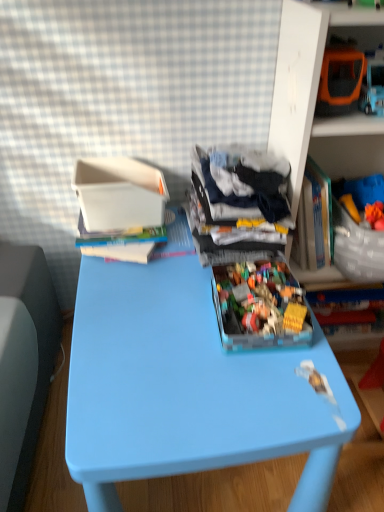
This screenshot has width=384, height=512. What do you see at coordinates (296, 88) in the screenshot?
I see `translucent plastic container at upper right, arranged as the 1th shelf when viewed from the right` at bounding box center [296, 88].

Describe the element at coordinates (189, 388) in the screenshot. The width and height of the screenshot is (384, 512). I see `blue plastic table at center` at that location.

Where is `translucent plastic container at center`? The image size is (384, 512). translucent plastic container at center is located at coordinates (260, 306).

What do you see at coordinates (119, 194) in the screenshot? I see `white plastic container at upper left` at bounding box center [119, 194].

Measure the distance between white plastic container at upper left and camera.

They are 1.10 meters apart.

Locate an element on the screen. The width and height of the screenshot is (384, 512). orange plastic toy car at upper right, the 2th shelf from the right is located at coordinates (348, 125).

Can you confirm if blue plastic table at center is smaller than dark blue fabric at center?

Incorrect, blue plastic table at center is not smaller in size than dark blue fabric at center.

Considering the sizes of blue plastic table at center and dark blue fabric at center in the image, is blue plastic table at center wider or thinner than dark blue fabric at center?

Considering their sizes, blue plastic table at center looks broader than dark blue fabric at center.

From a real-world perspective, between blue plastic table at center and dark blue fabric at center, who is vertically higher?

dark blue fabric at center is physically above.

Where is `table in front of the dark blue fabric at center`? table in front of the dark blue fabric at center is located at coordinates (189, 388).

Locate an element on the screen. The height and width of the screenshot is (512, 384). toy lying in front of the dark blue fabric at center is located at coordinates (260, 306).

Could translucent plastic container at center be considered to be inside dark blue fabric at center?

No.

Which of these two, dark blue fabric at center or translucent plastic container at center, stands shorter?

translucent plastic container at center is shorter.

From the image's perspective, is dark blue fabric at center above or below translucent plastic container at center?

Based on their image positions, dark blue fabric at center is located above translucent plastic container at center.

From a real-world perspective, is orange plastic toy car at upper right, the 2th shelf from the right, physically located above or below dark blue fabric at center?

Clearly, from a real-world perspective, orange plastic toy car at upper right, the 2th shelf from the right, is above dark blue fabric at center.

Is orange plastic toy car at upper right, the 2th shelf from the right, oriented away from dark blue fabric at center?

No, dark blue fabric at center is not at the back of orange plastic toy car at upper right, the 2th shelf from the right.

From the image's perspective, between orange plastic toy car at upper right, the 2th shelf from the right, and dark blue fabric at center, who is located below?

dark blue fabric at center is shown below in the image.

Is translucent plastic container at upper right, marked as the second shelf in a left-to-right arrangement, facing towards translucent plastic container at center?

No, translucent plastic container at upper right, marked as the second shelf in a left-to-right arrangement, is not oriented towards translucent plastic container at center.

Starting from the translucent plastic container at center, which shelf is the 2nd one to the right? Please provide its 2D coordinates.

[(296, 88)]

Is translucent plastic container at upper right, arranged as the 1th shelf when viewed from the right, wider or thinner than translucent plastic container at center?

In the image, translucent plastic container at upper right, arranged as the 1th shelf when viewed from the right, appears to be wider than translucent plastic container at center.

From the image's perspective, is translucent plastic container at upper right, marked as the second shelf in a left-to-right arrangement, positioned above or below translucent plastic container at center?

From the image's perspective, translucent plastic container at upper right, marked as the second shelf in a left-to-right arrangement, appears above translucent plastic container at center.

Measure the distance between blue plastic table at center and orange plastic toy car at upper right, the 2th shelf from the right.

blue plastic table at center is 24.46 inches away from orange plastic toy car at upper right, the 2th shelf from the right.

Is blue plastic table at center taller or shorter than orange plastic toy car at upper right, the 2th shelf from the right?

In the image, blue plastic table at center appears to be taller than orange plastic toy car at upper right, the 2th shelf from the right.

From a real-world perspective, who is located higher, blue plastic table at center or orange plastic toy car at upper right, the first shelf viewed from the left?

orange plastic toy car at upper right, the first shelf viewed from the left, is physically above.

From the image's perspective, which is below, blue plastic table at center or orange plastic toy car at upper right, the 2th shelf from the right?

blue plastic table at center, from the image's perspective.

Is white plastic container at upper left next to blue plastic table at center and touching it?

white plastic container at upper left and blue plastic table at center are clearly separated.

Considering the relative sizes of white plastic container at upper left and blue plastic table at center in the image provided, is white plastic container at upper left shorter than blue plastic table at center?

Yes, white plastic container at upper left is shorter than blue plastic table at center.

Is white plastic container at upper left inside the boundaries of blue plastic table at center, or outside?

white plastic container at upper left is not enclosed by blue plastic table at center.

From a real-world perspective, is translucent plastic container at center positioned above or below translucent plastic container at upper right, arranged as the 1th shelf when viewed from the right?

From a real-world perspective, translucent plastic container at center is physically below translucent plastic container at upper right, arranged as the 1th shelf when viewed from the right.

Is translucent plastic container at center to the left or to the right of translucent plastic container at upper right, arranged as the 1th shelf when viewed from the right, in the image?

In the image, translucent plastic container at center appears on the left side of translucent plastic container at upper right, arranged as the 1th shelf when viewed from the right.

Does point (226, 335) come behind point (320, 42)?

Yes, point (226, 335) is farther from viewer.

How much distance is there between translucent plastic container at center and translucent plastic container at upper right, marked as the second shelf in a left-to-right arrangement?

translucent plastic container at center is 13.27 inches away from translucent plastic container at upper right, marked as the second shelf in a left-to-right arrangement.

Identify the location of clothing that appears above the blue plastic table at center (from a real-world perspective). The height and width of the screenshot is (512, 384). (243, 193).

Locate an element on the screen. The height and width of the screenshot is (512, 384). toy that appears below the dark blue fabric at center (from a real-world perspective) is located at coordinates (260, 306).

Based on their spatial positions, is translucent plastic container at center or dark blue fabric at center further from translucent plastic container at upper right, marked as the second shelf in a left-to-right arrangement?

translucent plastic container at center.

When comparing their distances from orange plastic toy car at upper right, the first shelf viewed from the left, does translucent plastic container at upper right, marked as the second shelf in a left-to-right arrangement, or blue plastic table at center seem closer?

Among the two, translucent plastic container at upper right, marked as the second shelf in a left-to-right arrangement, is located nearer to orange plastic toy car at upper right, the first shelf viewed from the left.

Considering their positions, is orange plastic toy car at upper right, the 2th shelf from the right, positioned further to blue plastic table at center than translucent plastic container at center?

orange plastic toy car at upper right, the 2th shelf from the right, is further to blue plastic table at center.

Looking at this image, considering their positions, is blue plastic table at center positioned further to white plastic container at upper left than orange plastic toy car at upper right, the 2th shelf from the right?

orange plastic toy car at upper right, the 2th shelf from the right, is further to white plastic container at upper left.

From the image, which object appears to be nearer to translucent plastic container at center, blue plastic table at center or dark blue fabric at center?

Among the two, blue plastic table at center is located nearer to translucent plastic container at center.

Which object lies further to the anchor point blue plastic table at center, white plastic container at upper left or translucent plastic container at upper right, marked as the second shelf in a left-to-right arrangement?

translucent plastic container at upper right, marked as the second shelf in a left-to-right arrangement, is further to blue plastic table at center.

Based on their spatial positions, is orange plastic toy car at upper right, the 2th shelf from the right, or white plastic container at upper left closer to translucent plastic container at center?

white plastic container at upper left is positioned closer to the anchor translucent plastic container at center.

From the image, which object appears to be nearer to dark blue fabric at center, orange plastic toy car at upper right, the 2th shelf from the right, or white plastic container at upper left?

Among the two, orange plastic toy car at upper right, the 2th shelf from the right, is located nearer to dark blue fabric at center.

Find the location of a particular element. This screenshot has width=384, height=512. clothing situated between white plastic container at upper left and orange plastic toy car at upper right, the 2th shelf from the right, from left to right is located at coordinates (243, 193).

I want to click on clothing between orange plastic toy car at upper right, the 2th shelf from the right, and translucent plastic container at center in the up-down direction, so click(243, 193).

This screenshot has width=384, height=512. Identify the location of table located between white plastic container at upper left and translucent plastic container at upper right, arranged as the 1th shelf when viewed from the right, in the left-right direction. (189, 388).

Locate an element on the screen. The height and width of the screenshot is (512, 384). cardboard box between orange plastic toy car at upper right, the 2th shelf from the right, and blue plastic table at center from top to bottom is located at coordinates [x=119, y=194].